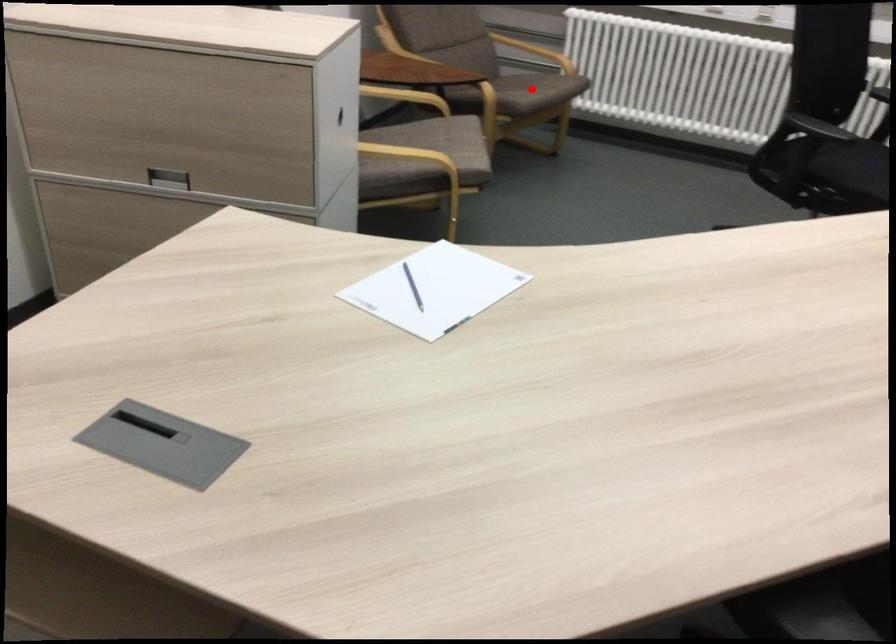
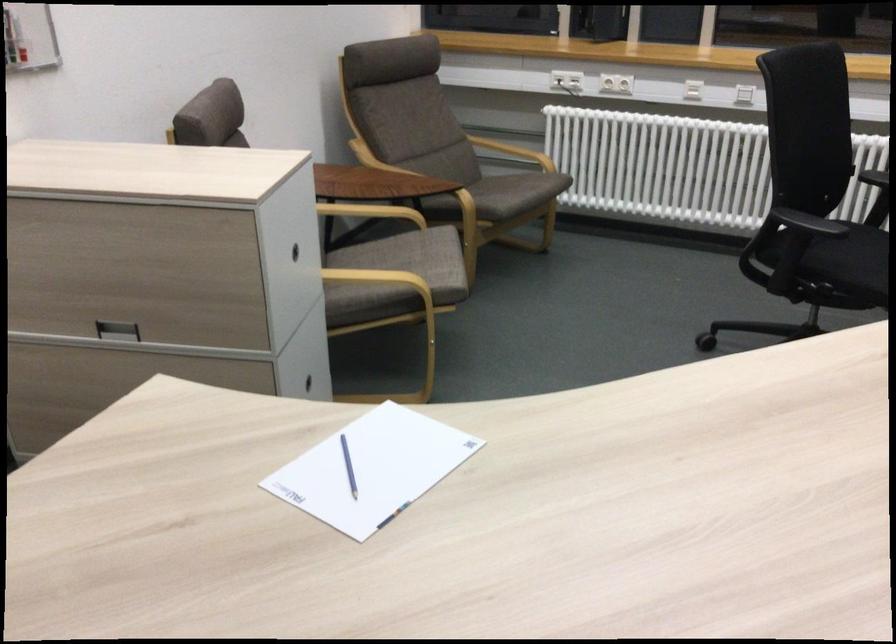
Find the pixel in the second image that matches the highlighted location in the first image.

(510, 191)